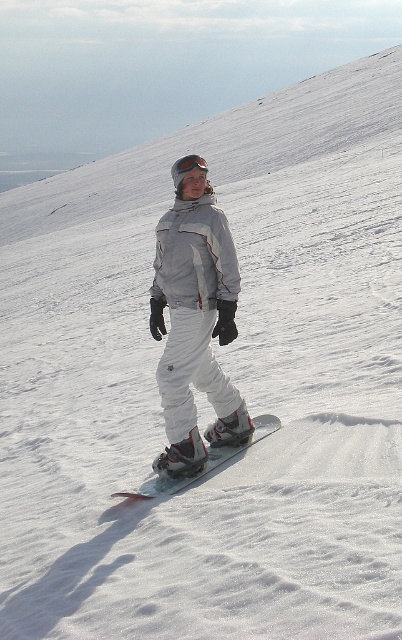
You are a drone operator trying to capture a photo of the white matte snowboarder at center and the matte black goggles at center. The camera has a minimum focus distance of 5 feet. Will the drone be able to focus on both objects if it is positioned exactly between them?

The distance between the white matte snowboarder at center and the matte black goggles at center is 6.08 feet. Since the drone is positioned exactly between them, the distance from the drone to each object would be half of 6.08 feet, which is approximately 3.04 feet. This is less than the camera minimum focus distance of 5 feet, so the drone will not be able to focus on both objects.

You are a photographer standing at the camera position. You want to take a photo of the snowboarder. The snowboarder is currently at point point (223,372). If you want to capture them in your photo, will you need to adjust your camera focus to be closer than 8 meters?

The distance of point (223,372) from camera is 7.81 meters, so yes, you will need to adjust your camera focus to be closer than 8 meters to capture the snowboarder clearly.